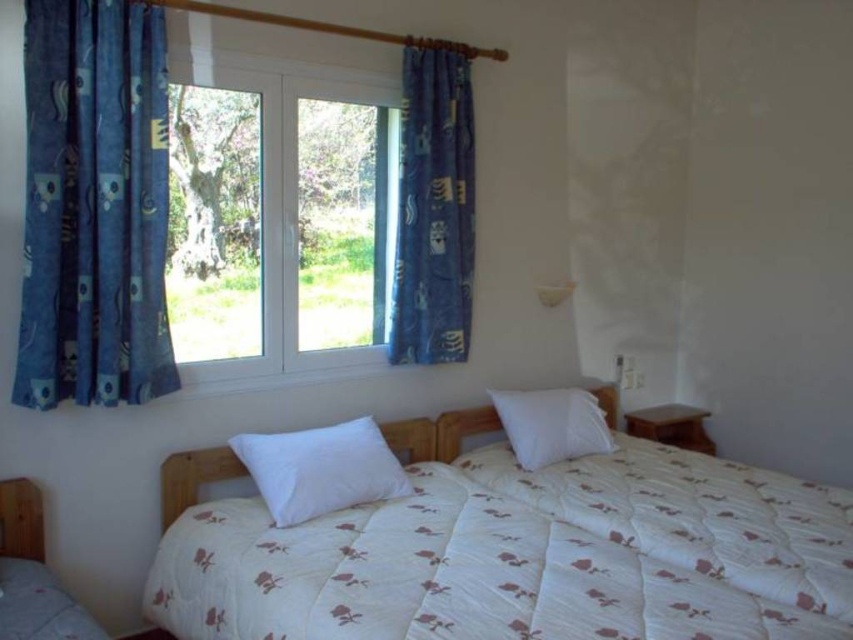
Question: Can you confirm if white soft pillow at center is positioned to the right of white soft pillow at upper right?

Choices:
 (A) no
 (B) yes

Answer: (A)

Question: Estimate the real-world distances between objects in this image. Which object is closer to the white quilted blanket at center?

Choices:
 (A) white soft pillow at upper right
 (B) white soft pillow at center
 (C) white plastic window at center

Answer: (A)

Question: Can you confirm if blue printed fabric curtain at center is smaller than white soft pillow at upper right?

Choices:
 (A) no
 (B) yes

Answer: (A)

Question: Does white plastic window at center appear on the left side of white quilted blanket at center?

Choices:
 (A) yes
 (B) no

Answer: (A)

Question: Which object appears farthest from the camera in this image?

Choices:
 (A) blue printed fabric curtain at center
 (B) white quilted bed at center

Answer: (A)

Question: Based on their relative distances, which object is nearer to the blue printed fabric curtain at center?

Choices:
 (A) white quilted bed at center
 (B) white soft pillow at center

Answer: (B)